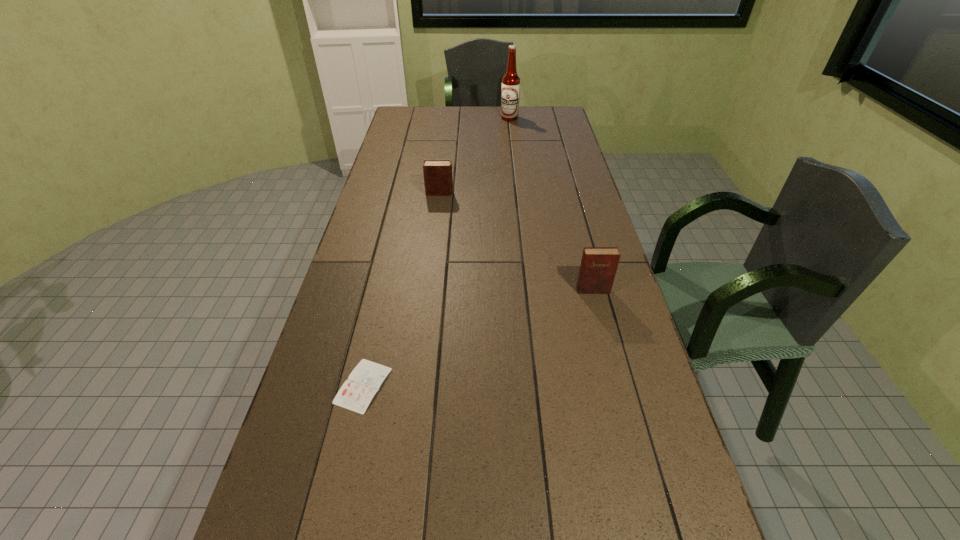
Locate an element on the screen. blank region between the leftmost diary and the third farthest object is located at coordinates (478, 338).

You are a GUI agent. You are given a task and a screenshot of the screen. Output one action in this format:
    pyautogui.click(x=<x>, y=<y>)
    Task: Click on the free space between the third object from right to left and the second object from right to left
    The width and height of the screenshot is (960, 540).
    Given the screenshot: What is the action you would take?
    pyautogui.click(x=474, y=156)

The height and width of the screenshot is (540, 960). Identify the location of vacant region between the third object from right to left and the second nearest diary. (516, 241).

In order to click on free space between the third tallest object and the nearest object in this screenshot , I will do `click(401, 289)`.

Find the location of `vacant area that lies between the farthest diary and the alcohol`. vacant area that lies between the farthest diary and the alcohol is located at coordinates (474, 156).

Where is `free spot between the alcohol and the second nearest diary`? This screenshot has height=540, width=960. free spot between the alcohol and the second nearest diary is located at coordinates (551, 204).

The width and height of the screenshot is (960, 540). Find the location of `free space between the leftmost object and the third object from right to left`. free space between the leftmost object and the third object from right to left is located at coordinates (401, 289).

This screenshot has height=540, width=960. Identify the location of empty space that is in between the third object from left to right and the rightmost object. (551, 204).

At what (x,y) coordinates should I click in order to perform the action: click on free space between the second farthest diary and the leftmost object. Please return your answer as a coordinate pair (x, y). The width and height of the screenshot is (960, 540). Looking at the image, I should click on (478, 338).

I want to click on object that ranks as the closest to the farthest object, so click(x=438, y=181).